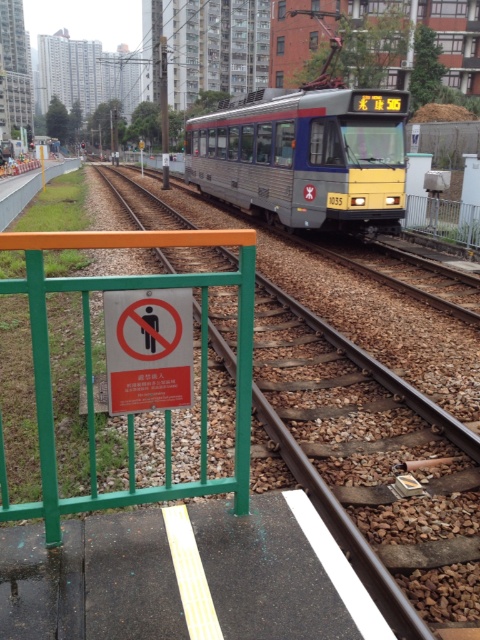
Is brown gravel train track at center bigger than metallic silver train at center?

No.

Does brown gravel train track at center appear over metallic silver train at center?

Incorrect, brown gravel train track at center is not positioned above metallic silver train at center.

Find the location of `brown gravel train track at center`. brown gravel train track at center is located at coordinates (361, 449).

Is metallic silver train at center to the right of green metal fence at right from the viewer's perspective?

No, metallic silver train at center is not to the right of green metal fence at right.

Can you confirm if metallic silver train at center is wider than green metal fence at right?

Indeed, metallic silver train at center has a greater width compared to green metal fence at right.

Is point (218, 189) behind point (433, 218)?

Yes.

The width and height of the screenshot is (480, 640). Identify the location of metallic silver train at center. (305, 157).

Describe the element at coordinates (305, 157) in the screenshot. I see `metallic silver train at center` at that location.

Between point (335, 220) and point (139, 388), which one is positioned in front?

Point (139, 388) is more forward.

The height and width of the screenshot is (640, 480). I want to click on metallic silver train at center, so click(x=305, y=157).